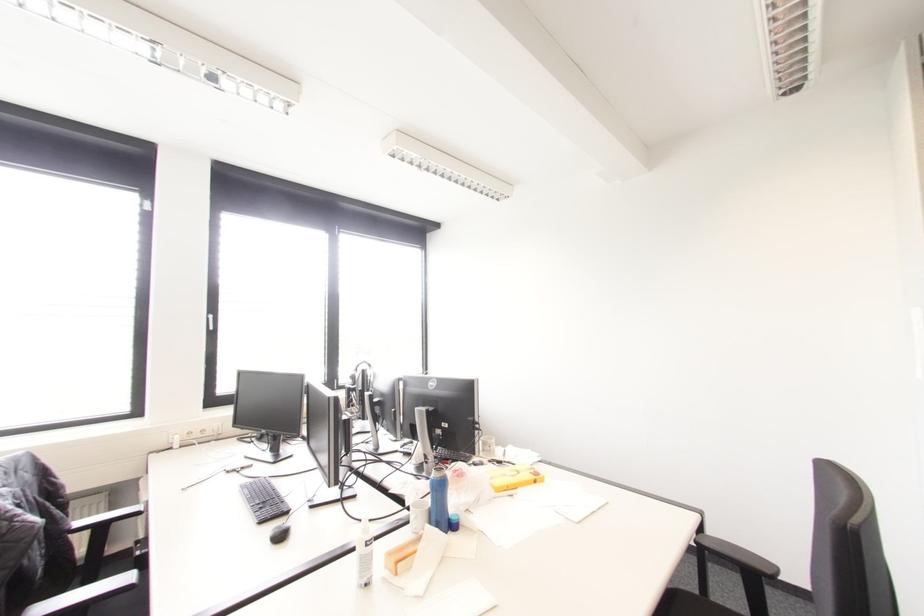
Where is `black computer mouse`? Image resolution: width=924 pixels, height=616 pixels. black computer mouse is located at coordinates (280, 533).